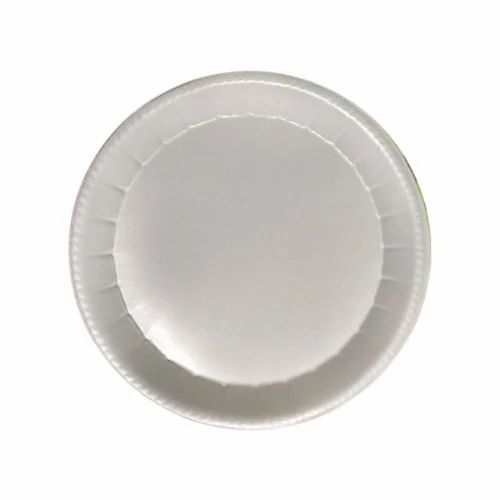
This screenshot has width=500, height=500. What are the coordinates of `widest parts of plate` in the screenshot? It's located at (68, 250), (431, 244), (250, 72), (241, 427).